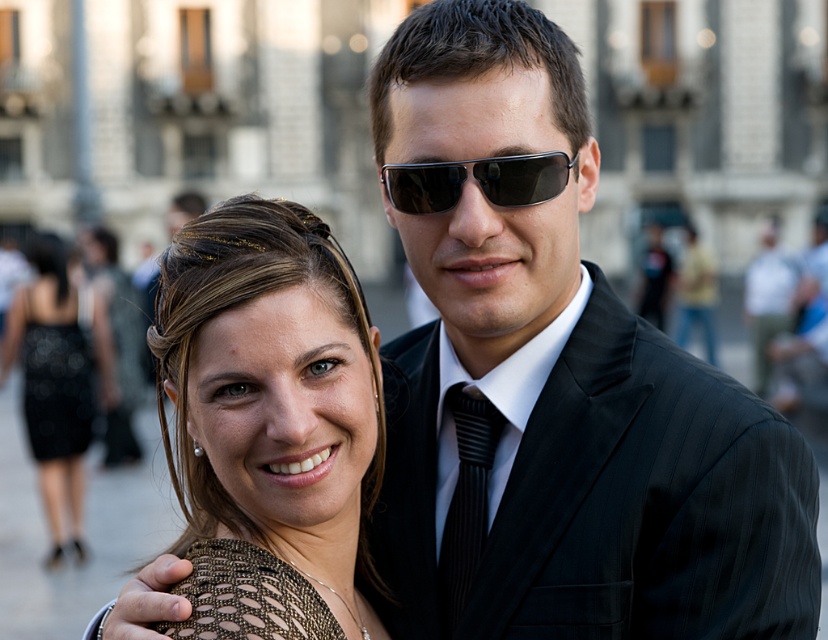
Does satin black dress at lower left appear over black satin dress at lower left?

Actually, satin black dress at lower left is below black satin dress at lower left.

Locate an element on the screen. satin black dress at lower left is located at coordinates (51, 385).

Can you confirm if black satin dress at lower left is bigger than black plastic sunglasses at center?

Yes, black satin dress at lower left is bigger than black plastic sunglasses at center.

Which is in front, point (80, 417) or point (545, 192)?

Positioned in front is point (545, 192).

Between point (37, 412) and point (417, 211), which one is positioned behind?

Point (37, 412)

Image resolution: width=828 pixels, height=640 pixels. I want to click on black satin dress at lower left, so click(x=56, y=388).

Can you confirm if satin black dress at lower left is smaller than black striped tie at center?

No, satin black dress at lower left is not smaller than black striped tie at center.

Looking at this image, who is lower down, satin black dress at lower left or black striped tie at center?

Positioned lower is black striped tie at center.

The image size is (828, 640). I want to click on satin black dress at lower left, so click(51, 385).